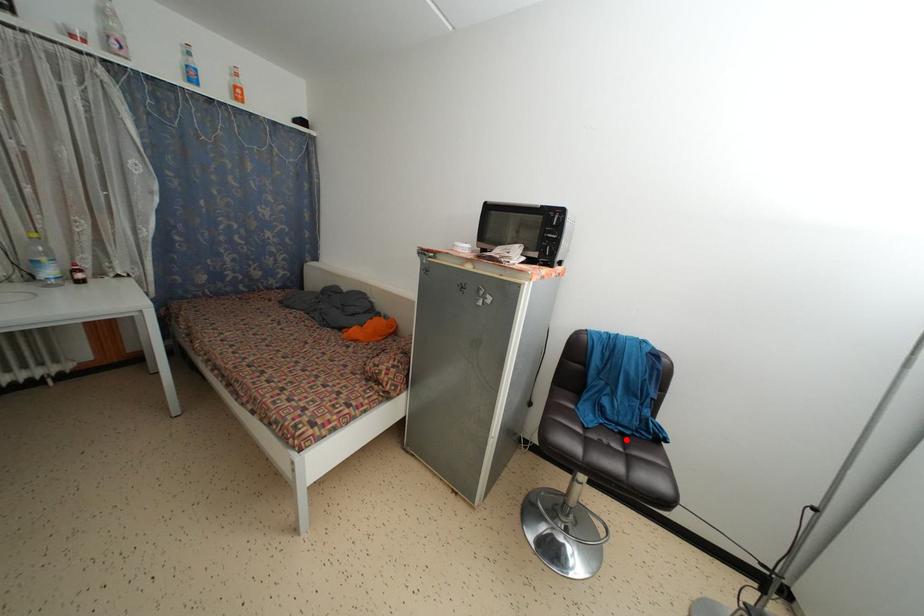
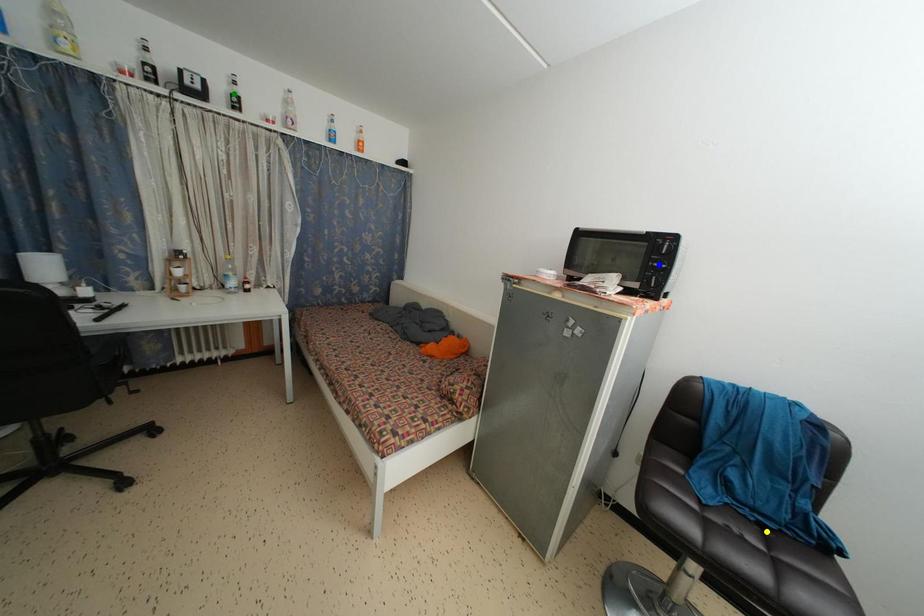
Question: I am providing you with two images of the same scene from different viewpoints. A red point is marked on the first image. You are given multiple points on the second image. In image 2, which mark is for the same physical point as the one in image 1?

Choices:
 (A) yellow point
 (B) green point
 (C) blue point

Answer: (A)